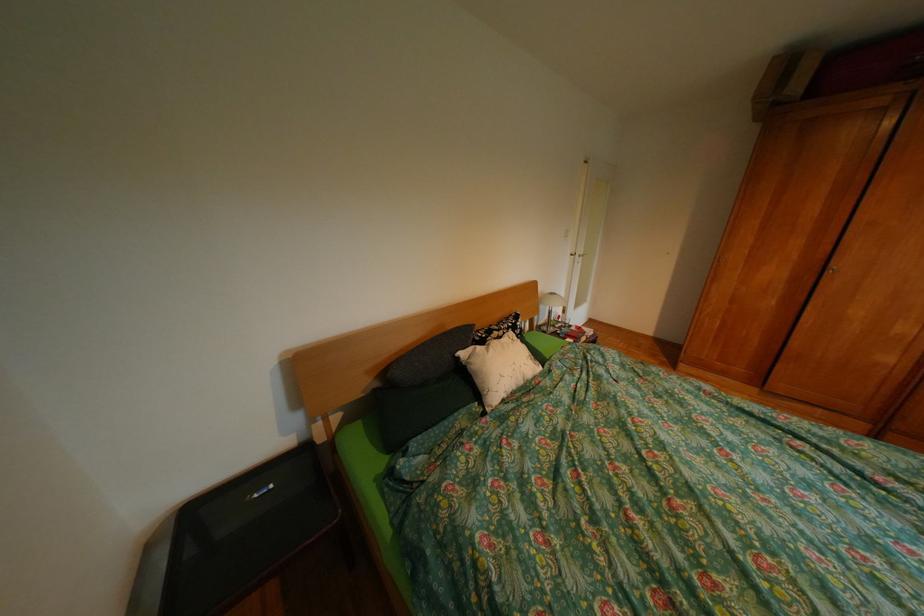
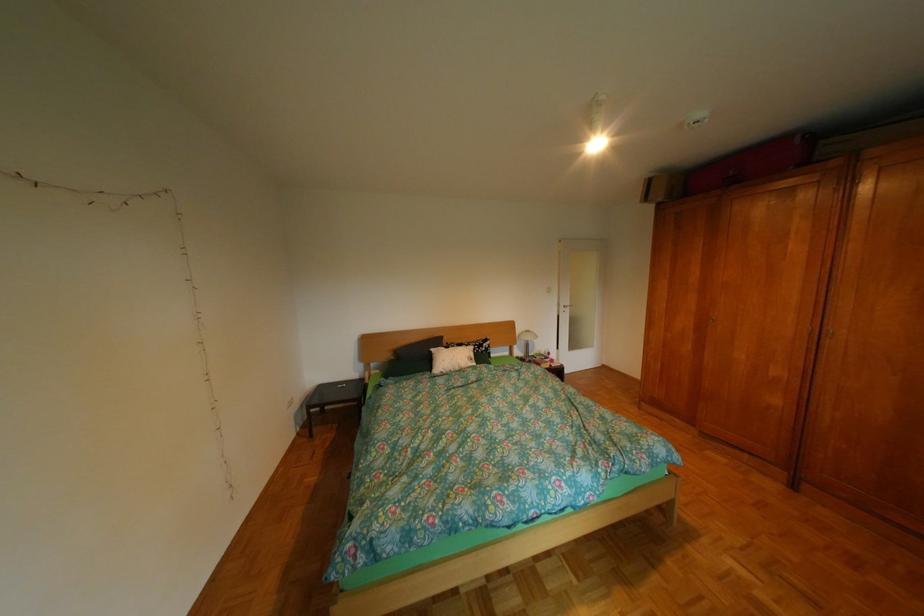
Locate, in the second image, the point that corresponds to (x=392, y=385) in the first image.

(407, 359)